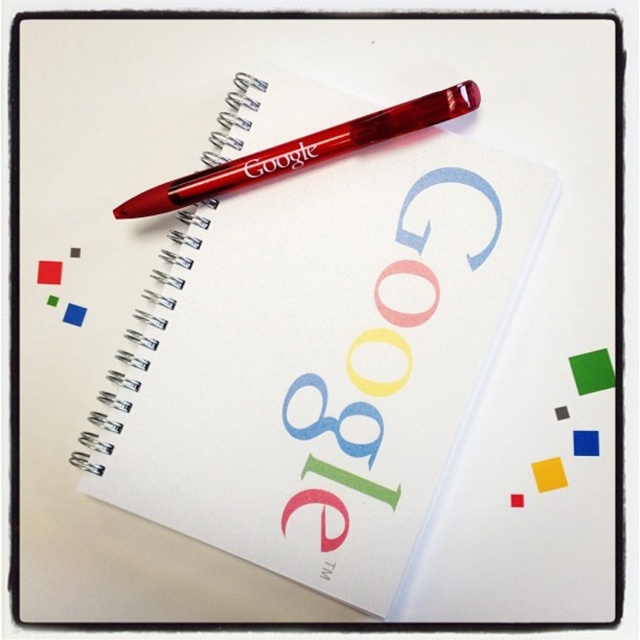
You are examining the notebook and need to determine which of the two points, point (356, 445) or point (472, 268), is nearer to you. Based on the image, which point is closer?

Point (356, 445) is closer to the camera than point (472, 268).

You are organizing a desk and need to place the transparent plastic notebook at center and the smooth plastic g at center. Based on their positions in the image, which object is closer to the bottom edge of the desk?

The transparent plastic notebook at center is closer to the bottom edge of the desk because it is located below the smooth plastic g at center.

You are an artist trying to sketch the Google logo on the notebook. You notice two elements on the cover. Which one is shorter in height between the matte blue letter at center and the smooth plastic g at center?

The matte blue letter at center is not as tall as the smooth plastic g at center, so the matte blue letter at center is shorter in height.